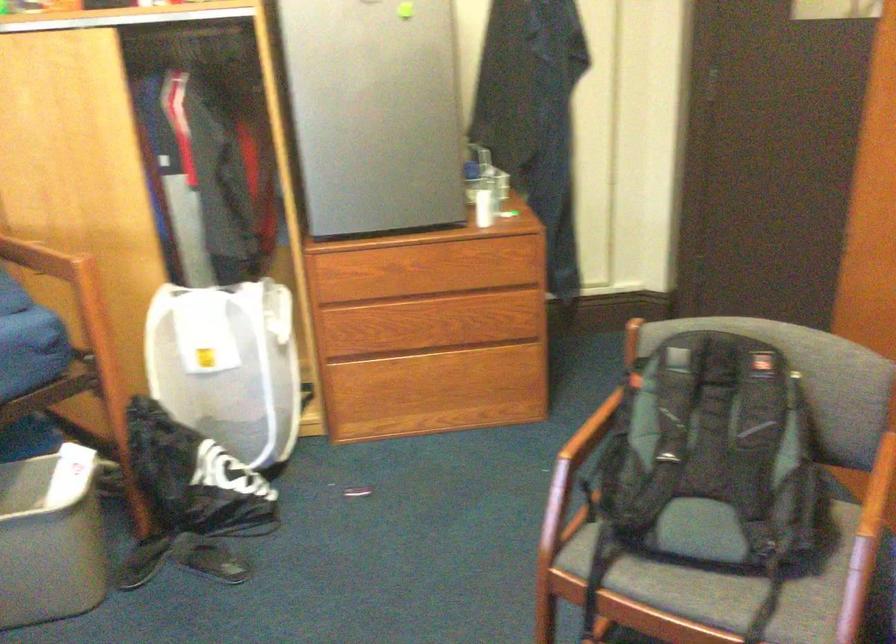
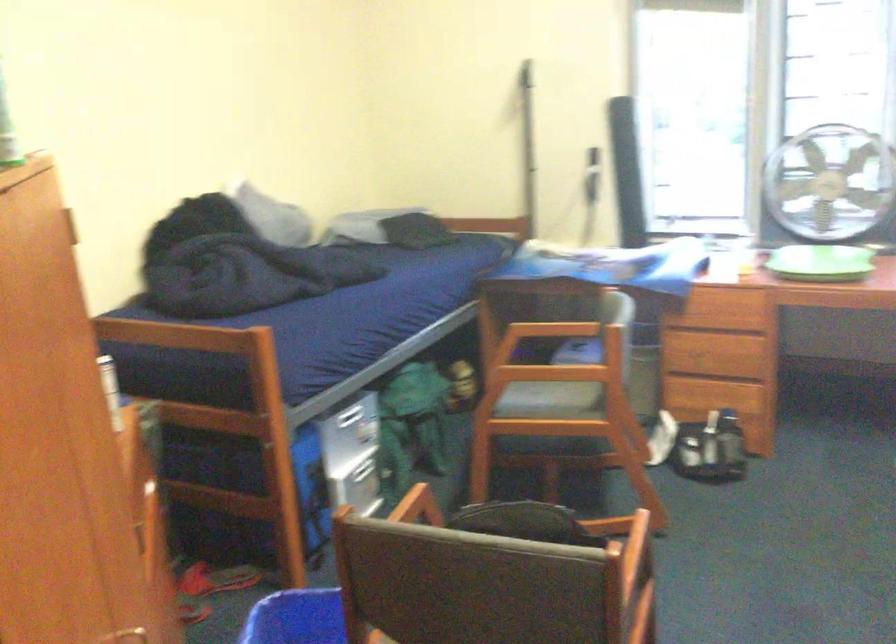
Question: I am providing you with two images of the same scene from different viewpoints. Which of the following objects are not visible in image2?

Choices:
 (A) dark chair seat
 (B) jar latch
 (C) wooden chair armrest
 (D) silver drawer handle

Answer: (C)